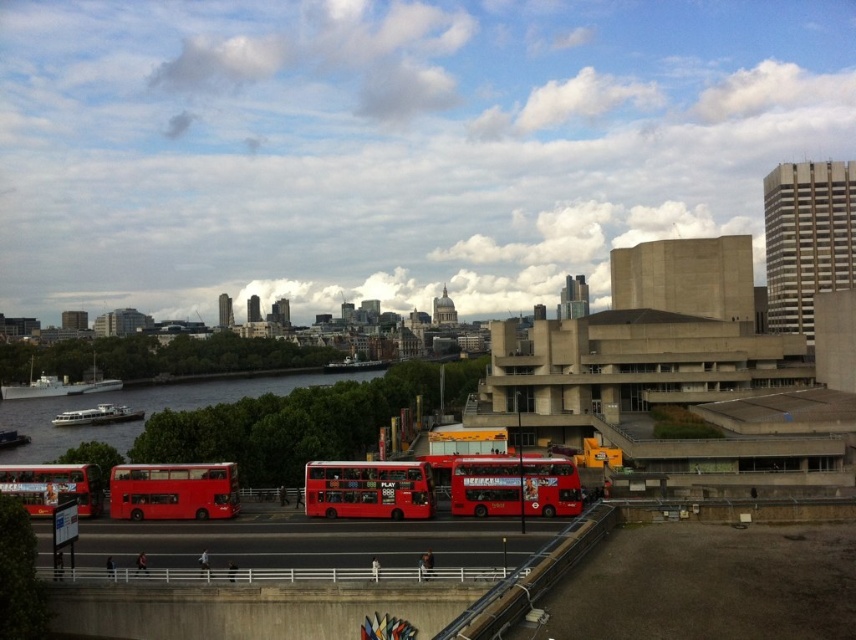
Is matte red bus at center thinner than matte red double-decker bus at lower left?

Correct, matte red bus at center's width is less than matte red double-decker bus at lower left's.

Looking at this image, who is positioned more to the right, matte red bus at center or matte red double-decker bus at lower left?

matte red bus at center is more to the right.

Locate an element on the screen. This screenshot has height=640, width=856. matte red bus at center is located at coordinates (173, 490).

Is red matte double-decker bus at center positioned at the back of matte red double-decker bus at center?

Yes, red matte double-decker bus at center is behind matte red double-decker bus at center.

Can you confirm if red matte double-decker bus at center is positioned below matte red double-decker bus at center?

Actually, red matte double-decker bus at center is above matte red double-decker bus at center.

Image resolution: width=856 pixels, height=640 pixels. I want to click on red matte double-decker bus at center, so click(514, 486).

Consider the image. Between matte red double-decker bus at center and matte red bus at center, which one has more height?

Standing taller between the two is matte red double-decker bus at center.

Does matte red double-decker bus at center have a lesser width compared to matte red bus at center?

In fact, matte red double-decker bus at center might be wider than matte red bus at center.

Identify the location of matte red double-decker bus at center. (367, 490).

Where is `matte red double-decker bus at center`? matte red double-decker bus at center is located at coordinates (367, 490).